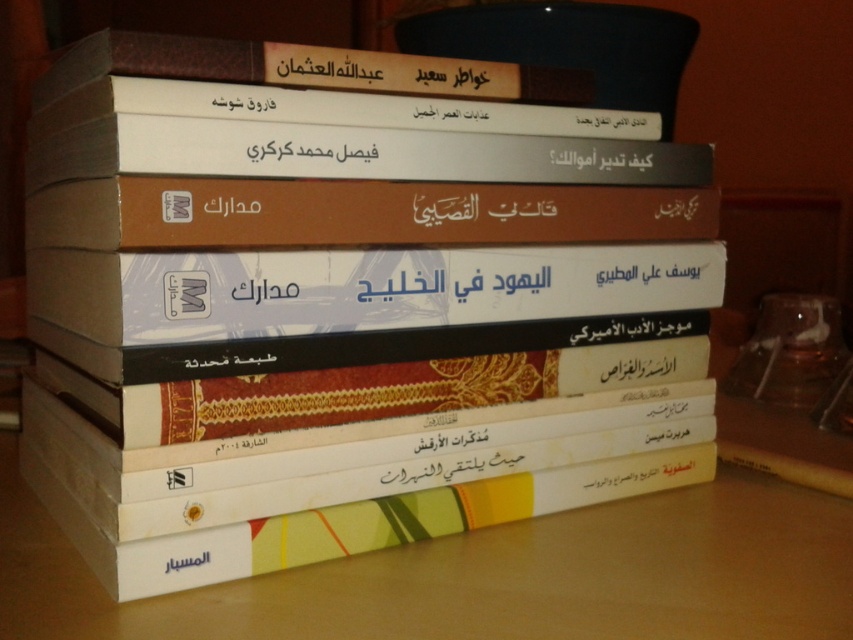
What are the coordinates of the white paper books at center?

The white paper books at center are located at coordinates point (486, 576).

You are organizing a bookshelf and need to place the white paper books at center and the black paper text at center. The shelf has a width of 12 inches. Can both items fit side by side without overlapping?

The white paper books at center and black paper text at center are 12.42 inches apart, which is wider than the 12 inch shelf. Therefore, they cannot fit side by side without overlapping.

You are organizing a library shelf and need to place the white glossy book at center and the black paper text at center. Since the shelf has limited space, which book should you place first to ensure both fit properly?

The white glossy book at center is larger in size than the black paper text at center. To ensure both fit on the shelf, place the larger white glossy book at center first, then the smaller black paper text at center.